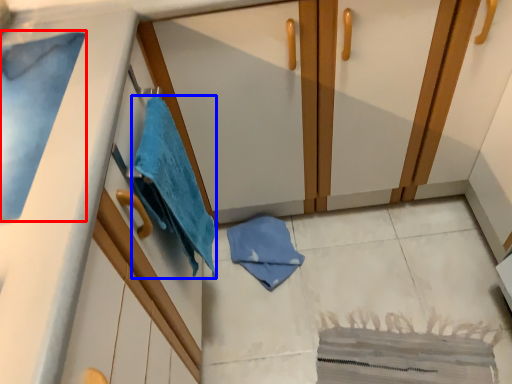
Question: Which point is further to the camera, bath towel (highlighted by a red box) or beach towel (highlighted by a blue box)?

Choices:
 (A) bath towel
 (B) beach towel

Answer: (B)